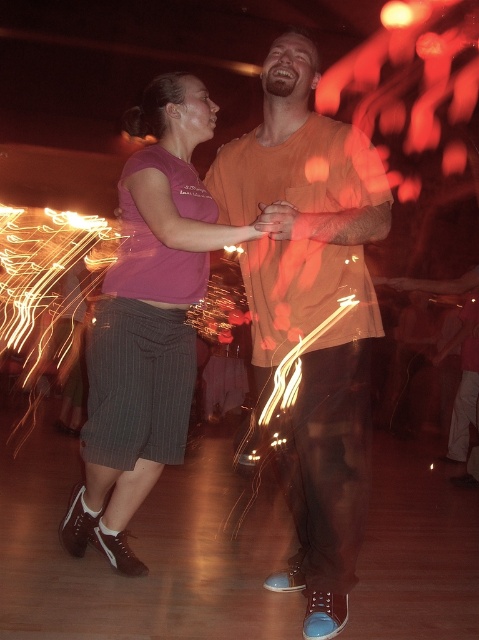
You are a photographer trying to capture a closeup shot of the couple in the foreground. You have two points marked on your viewfinder at coordinates point (262,70) and point (183,173). Which point should you focus on to ensure the closest subject is in focus?

Point (262,70) is closer to the camera than point (183,173), so focusing on point (262,70) will ensure the closest subject is in focus.

You are a photographer trying to capture a closeup of the orange cotton shirt at center and purple cotton shirt at center. Given that your camera can only focus on one shirt at a time, which shirt should you adjust the focus to first if you want to ensure both shirts are in focus? Explain your reasoning based on their sizes.

The orange cotton shirt at center is narrower than the purple cotton shirt at center. To ensure both shirts are in focus, you should focus on the orange cotton shirt at center first since it is smaller and closer to the camera, allowing the depth of field to cover the larger purple cotton shirt at center.

You are a photographer trying to capture the couple in the center. Which of the two shirts, the orange cotton shirt at center or the purple cotton shirt at center, is positioned higher in the frame?

The orange cotton shirt at center is located above the purple cotton shirt at center, so it is positioned higher in the frame.